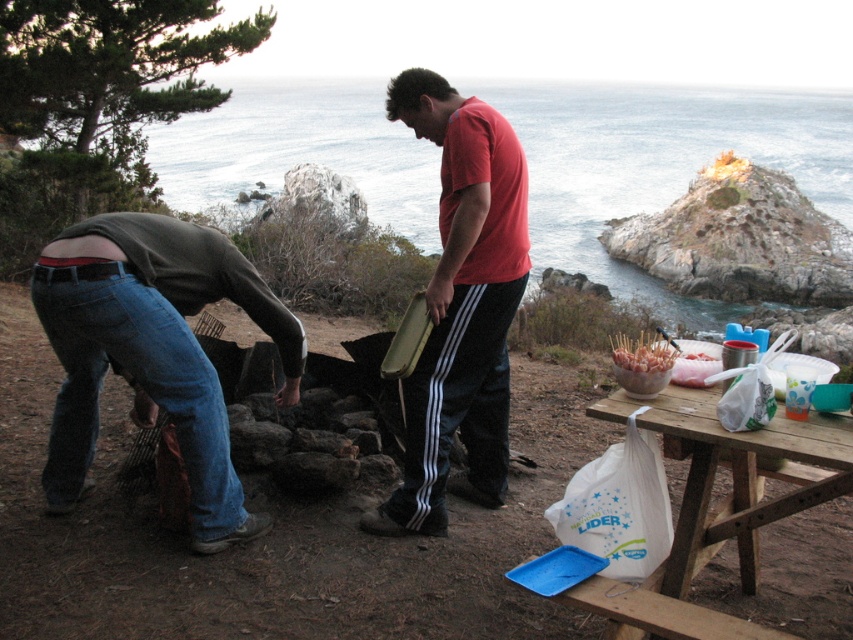
Question: Which object is the farthest from the denim jeans at lower left?

Choices:
 (A) white plastic bag at lower right
 (B) green matte shirt at center
 (C) jeans at center
 (D) red matte t-shirt at center

Answer: (A)

Question: Among these objects, which one is farthest from the camera?

Choices:
 (A) denim jeans at lower left
 (B) green matte shirt at center
 (C) red matte t-shirt at center

Answer: (B)

Question: Which is farther from the red matte t-shirt at center?

Choices:
 (A) denim jeans at lower left
 (B) green matte shirt at center
 (C) jeans at center
 (D) white plastic bag at lower right

Answer: (D)

Question: Does jeans at center appear under white plastic bag at lower right?

Choices:
 (A) yes
 (B) no

Answer: (B)

Question: Is red matte t-shirt at center thinner than white plastic bag at lower right?

Choices:
 (A) yes
 (B) no

Answer: (A)

Question: Is red matte t-shirt at center closer to the viewer compared to jeans at center?

Choices:
 (A) no
 (B) yes

Answer: (B)